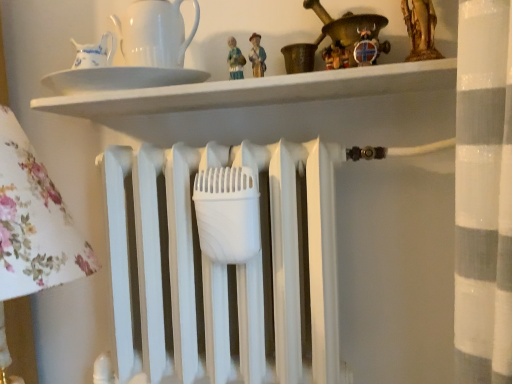
Question: From the image's perspective, is white glossy plate at upper center under white glossy pitcher at upper left?

Choices:
 (A) no
 (B) yes

Answer: (B)

Question: Would you say white glossy plate at upper center contains white glossy pitcher at upper left?

Choices:
 (A) yes
 (B) no

Answer: (B)

Question: Is white glossy plate at upper center at the right side of white glossy pitcher at upper left?

Choices:
 (A) no
 (B) yes

Answer: (B)

Question: Could you tell me if white glossy plate at upper center is turned towards white glossy pitcher at upper left?

Choices:
 (A) yes
 (B) no

Answer: (B)

Question: Is white glossy plate at upper center positioned beyond the bounds of white glossy pitcher at upper left?

Choices:
 (A) no
 (B) yes

Answer: (B)

Question: From a real-world perspective, is white glossy plate at upper center physically above white glossy pitcher at upper left?

Choices:
 (A) yes
 (B) no

Answer: (B)

Question: Would you say white glossy plate at upper center contains wooden viking helmet at upper center?

Choices:
 (A) yes
 (B) no

Answer: (B)

Question: Considering the relative sizes of white glossy plate at upper center and wooden viking helmet at upper center in the image provided, is white glossy plate at upper center thinner than wooden viking helmet at upper center?

Choices:
 (A) no
 (B) yes

Answer: (A)

Question: Is white glossy plate at upper center not near wooden viking helmet at upper center?

Choices:
 (A) yes
 (B) no

Answer: (B)

Question: Is white glossy plate at upper center oriented towards wooden viking helmet at upper center?

Choices:
 (A) yes
 (B) no

Answer: (B)

Question: Does white glossy plate at upper center have a lesser height compared to wooden viking helmet at upper center?

Choices:
 (A) no
 (B) yes

Answer: (B)

Question: Is white glossy plate at upper center at the left side of wooden viking helmet at upper center?

Choices:
 (A) yes
 (B) no

Answer: (A)

Question: From the image's perspective, is wooden viking helmet at upper center located above white glossy plate at upper center?

Choices:
 (A) no
 (B) yes

Answer: (B)